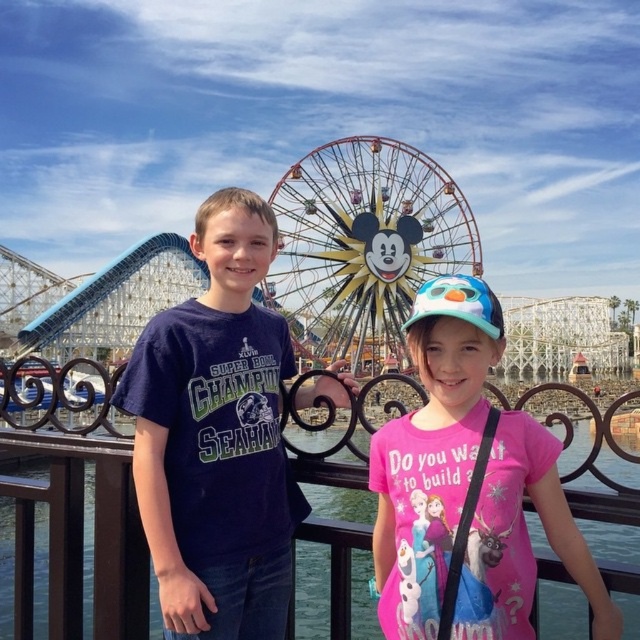
You are standing at the point marked as point (468,234) in the image. The Mickey Mouse Ferris wheel is located to your north. If you want to take a photo of the Ferris wheel with the two children in the foreground, which direction should you face?

You should face north to take a photo of the Mickey Mouse Ferris wheel with the two children in the foreground since the Ferris wheel is to your north and the children are in the foreground.